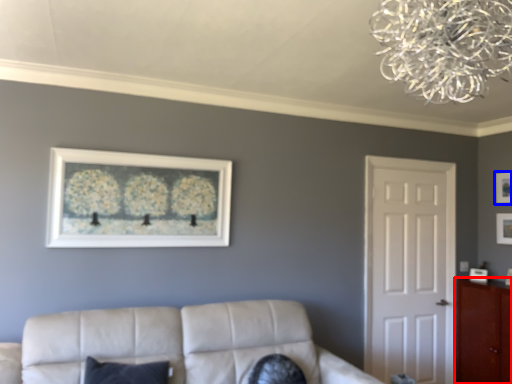
Question: Among these objects, which one is farthest to the camera, cabinetry (highlighted by a red box) or picture frame (highlighted by a blue box)?

Choices:
 (A) cabinetry
 (B) picture frame

Answer: (B)